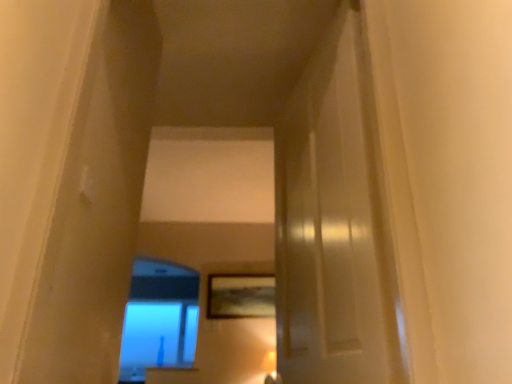
Describe the element at coordinates (240, 296) in the screenshot. I see `wooden textured picture frame at center` at that location.

In order to click on wooden textured picture frame at center in this screenshot , I will do (x=240, y=296).

What are the coordinates of `blue glass window at lower left` in the screenshot? It's located at (159, 319).

The image size is (512, 384). What do you see at coordinates (159, 319) in the screenshot?
I see `blue glass window at lower left` at bounding box center [159, 319].

This screenshot has height=384, width=512. What are the coordinates of `wooden textured picture frame at center` in the screenshot? It's located at (240, 296).

Is wooden textured picture frame at center at the right side of blue glass window at lower left?

Yes, wooden textured picture frame at center is to the right of blue glass window at lower left.

Is the depth of wooden textured picture frame at center less than that of blue glass window at lower left?

Yes, wooden textured picture frame at center is closer to the camera.

Which point is more distant from viewer, (x=255, y=298) or (x=181, y=308)?

Positioned behind is point (x=181, y=308).

Looking at this image, from the image's perspective, which is below, wooden textured picture frame at center or blue glass window at lower left?

blue glass window at lower left, from the image's perspective.

From a real-world perspective, is wooden textured picture frame at center under blue glass window at lower left?

Incorrect, from a real-world perspective, wooden textured picture frame at center is higher than blue glass window at lower left.

Considering the sizes of wooden textured picture frame at center and blue glass window at lower left in the image, is wooden textured picture frame at center wider or thinner than blue glass window at lower left?

In the image, wooden textured picture frame at center appears to be more narrow than blue glass window at lower left.

Between wooden textured picture frame at center and blue glass window at lower left, which one has less height?

Standing shorter between the two is wooden textured picture frame at center.

From the picture: Is wooden textured picture frame at center bigger or smaller than blue glass window at lower left?

Clearly, wooden textured picture frame at center is smaller in size than blue glass window at lower left.

Consider the image. Could blue glass window at lower left be considered to be inside wooden textured picture frame at center?

Actually, blue glass window at lower left is outside wooden textured picture frame at center.

Does wooden textured picture frame at center touch blue glass window at lower left?

No, wooden textured picture frame at center is not in contact with blue glass window at lower left.

Is wooden textured picture frame at center turned away from blue glass window at lower left?

Yes, wooden textured picture frame at center's orientation is away from blue glass window at lower left.

How different are the orientations of wooden textured picture frame at center and blue glass window at lower left in degrees?

6.08e-05 degrees.

Locate an element on the screen. picture frame on the right of blue glass window at lower left is located at coordinates (240, 296).

Does blue glass window at lower left appear on the right side of wooden textured picture frame at center?

In fact, blue glass window at lower left is to the left of wooden textured picture frame at center.

Which object is further away from the camera taking this photo, blue glass window at lower left or wooden textured picture frame at center?

Positioned behind is blue glass window at lower left.

Does point (172, 277) lie behind point (218, 301)?

That is False.

From the image's perspective, is blue glass window at lower left below wooden textured picture frame at center?

Indeed, from the image's perspective, blue glass window at lower left is shown beneath wooden textured picture frame at center.

From a real-world perspective, is blue glass window at lower left on top of wooden textured picture frame at center?

Actually, blue glass window at lower left is physically below wooden textured picture frame at center in the real world.

Is blue glass window at lower left thinner than wooden textured picture frame at center?

No, blue glass window at lower left is not thinner than wooden textured picture frame at center.

Who is shorter, blue glass window at lower left or wooden textured picture frame at center?

wooden textured picture frame at center is shorter.

Considering the sizes of objects blue glass window at lower left and wooden textured picture frame at center in the image provided, who is bigger, blue glass window at lower left or wooden textured picture frame at center?

blue glass window at lower left.

Would you say wooden textured picture frame at center is part of blue glass window at lower left's contents?

No.

Is there a large distance between blue glass window at lower left and wooden textured picture frame at center?

That's not correct — blue glass window at lower left is a little close to wooden textured picture frame at center.

Could you tell me if blue glass window at lower left is turned towards wooden textured picture frame at center?

Yes, blue glass window at lower left is facing wooden textured picture frame at center.

How different are the orientations of blue glass window at lower left and wooden textured picture frame at center in degrees?

The angle between the facing direction of blue glass window at lower left and the facing direction of wooden textured picture frame at center is 6.08e-05 degrees.

This screenshot has height=384, width=512. I want to click on picture frame above the blue glass window at lower left (from the image's perspective), so click(x=240, y=296).

You are a GUI agent. You are given a task and a screenshot of the screen. Output one action in this format:
    pyautogui.click(x=<x>, y=<y>)
    Task: Click on the window located underneath the wooden textured picture frame at center (from a real-world perspective)
    The height and width of the screenshot is (384, 512).
    Given the screenshot: What is the action you would take?
    pyautogui.click(x=159, y=319)

Find the location of a particular element. picture frame above the blue glass window at lower left (from a real-world perspective) is located at coordinates (240, 296).